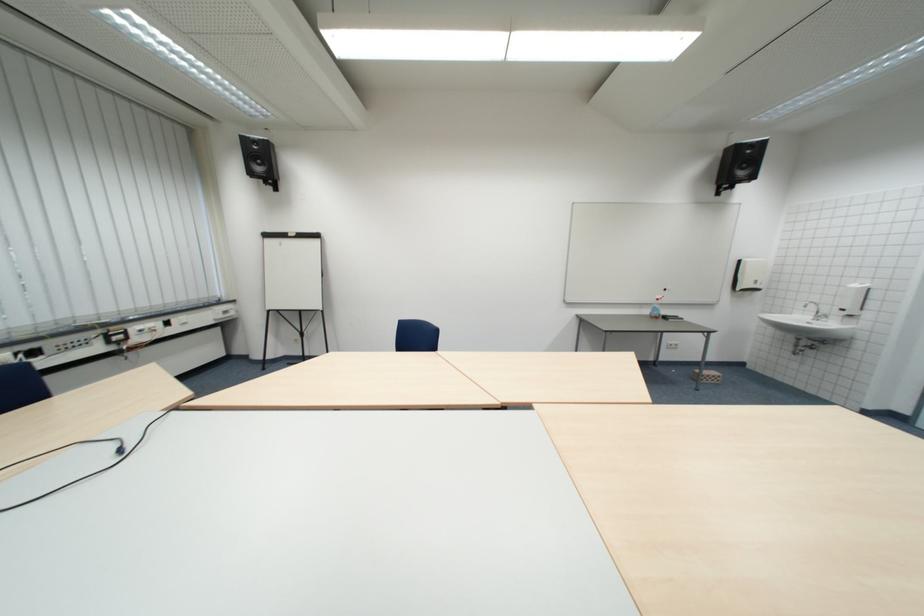
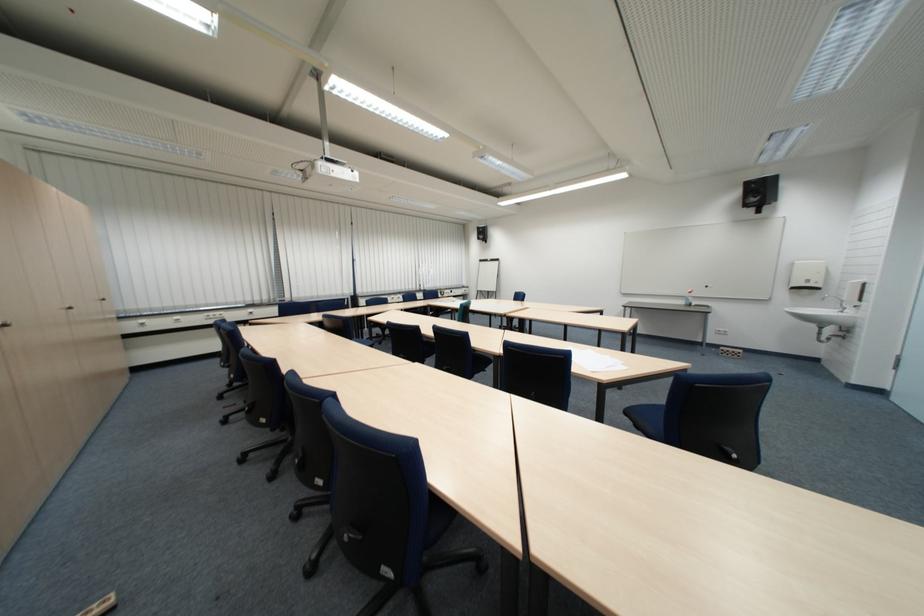
Where in the second image is the point corresponding to [864,305] from the first image?

(860, 296)